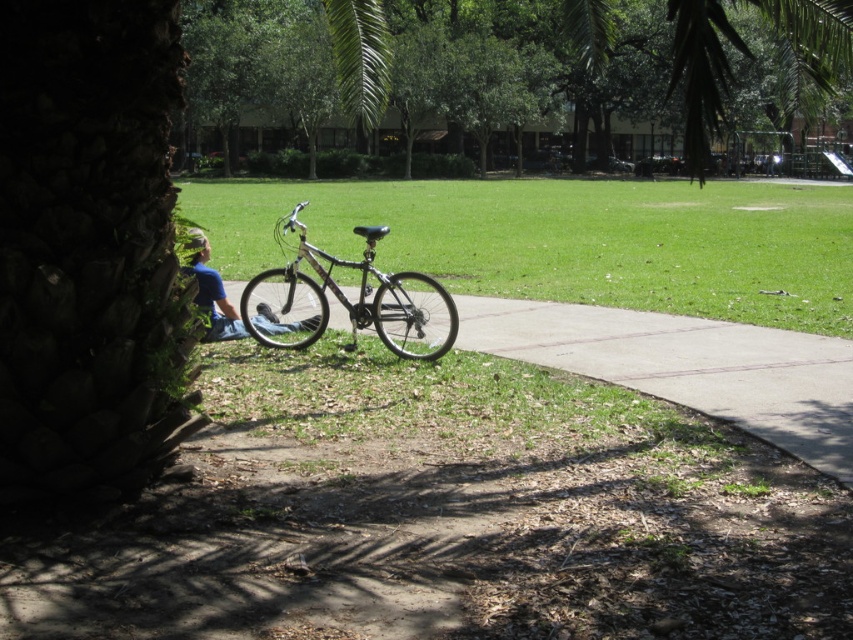
You are planning to ride the silver metallic bicycle at center across the gray concrete pavement at center. Based on the scene, is the bicycle currently on the pavement?

The gray concrete pavement at center is positioned under silver metallic bicycle at center, so yes, the bicycle is on the pavement.

You are planning to set up a picnic blanket in the park. You see the green grass at center and the silver metallic bicycle at center. Which area would be better for placing the picnic blanket and why?

The green grass at center is much taller than the silver metallic bicycle at center, so the area with the green grass at center would be better for placing the picnic blanket since taller grass typically provides a softer and more comfortable surface.